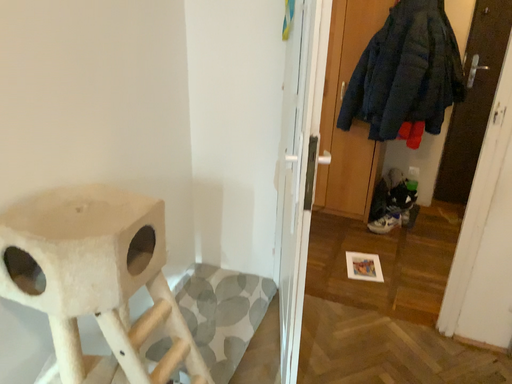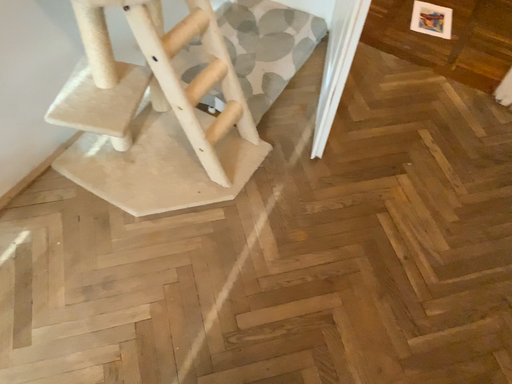
Question: Which way did the camera rotate in the video?

Choices:
 (A) rotated right
 (B) rotated left

Answer: (B)